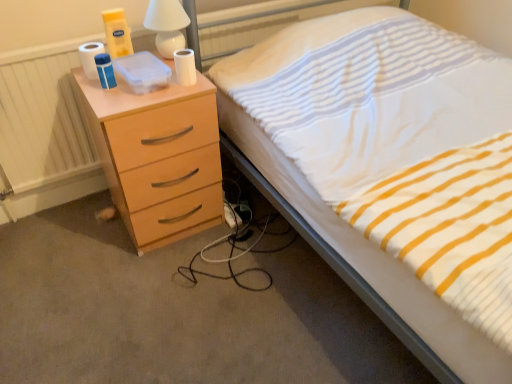
Locate an element on the screen. vacant space in front of white matte toilet paper at upper center, the 1th toilet paper viewed from the right is located at coordinates (170, 93).